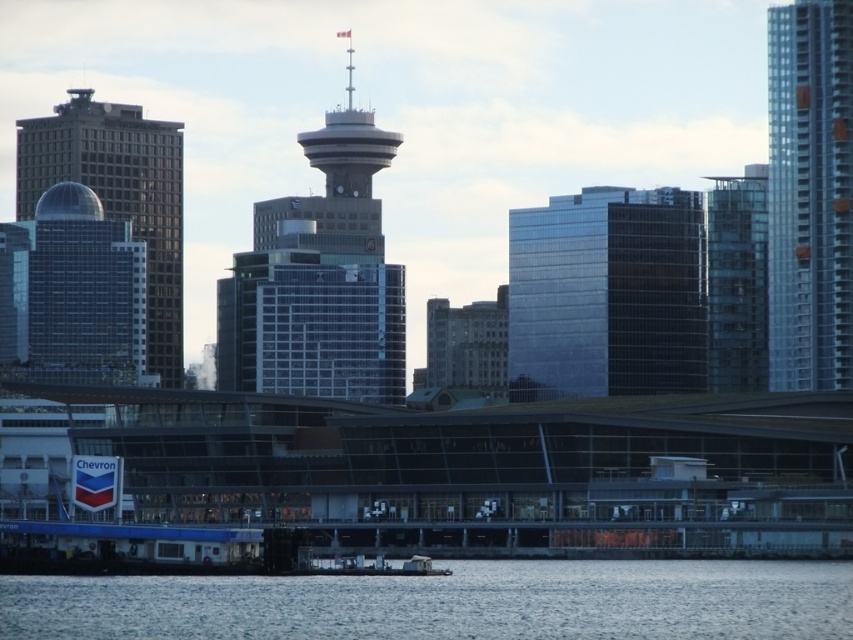
Does shiny glass building at center come behind transparent glass building at upper right?

That is False.

Is point (621, 336) in front of point (753, 301)?

Yes, point (621, 336) is closer to viewer.

Is point (566, 269) more distant than point (743, 276)?

No, it is in front of (743, 276).

Where is `shiny glass building at center`? The height and width of the screenshot is (640, 853). shiny glass building at center is located at coordinates (607, 294).

Who is taller, blue water at lower center or brown stone building at center?

Standing taller between the two is brown stone building at center.

Can you confirm if blue water at lower center is smaller than brown stone building at center?

Incorrect, blue water at lower center is not smaller in size than brown stone building at center.

Between point (267, 595) and point (473, 316), which one is positioned in front?

Point (267, 595)

Where is `blue water at lower center`? This screenshot has width=853, height=640. blue water at lower center is located at coordinates (448, 602).

Which is behind, point (372, 627) or point (799, 296)?

The point (799, 296) is more distant.

Which is behind, point (766, 563) or point (785, 125)?

The point (785, 125) is more distant.

The width and height of the screenshot is (853, 640). What are the coordinates of `blue water at lower center` in the screenshot? It's located at (448, 602).